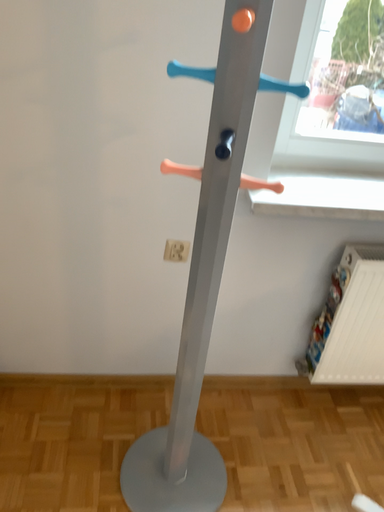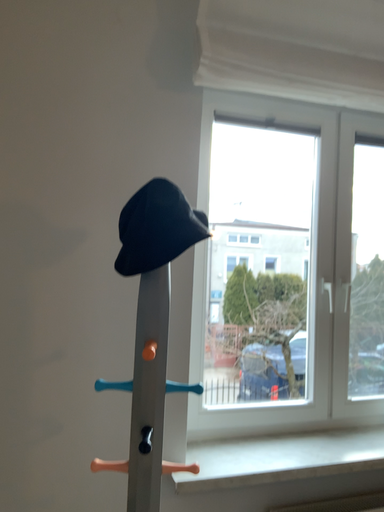
Question: How did the camera likely rotate when shooting the video?

Choices:
 (A) rotated downward
 (B) rotated upward

Answer: (B)